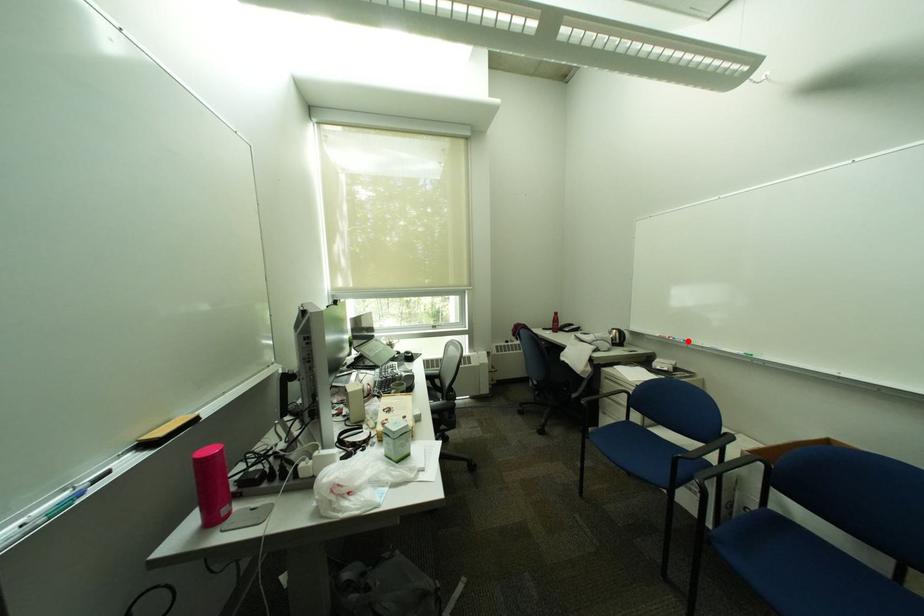
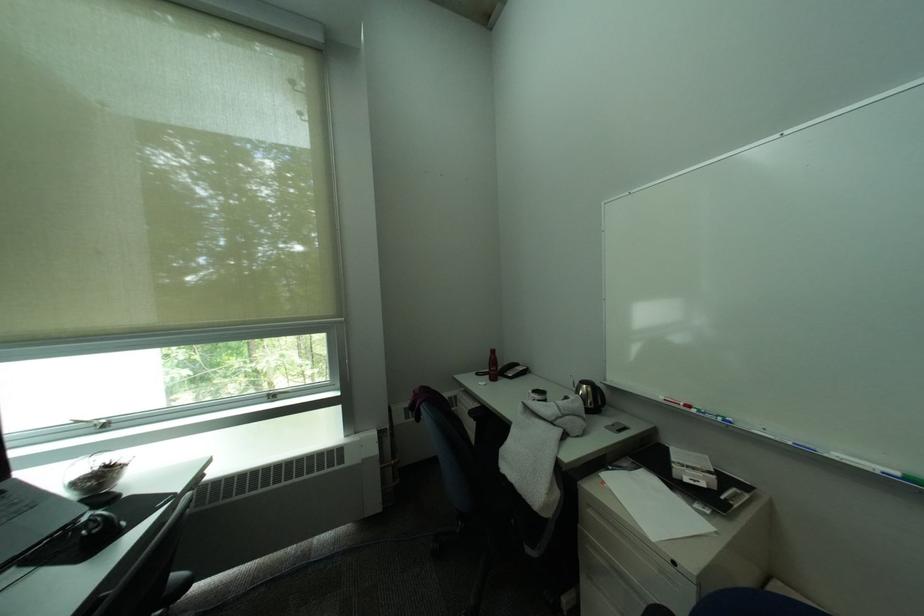
Locate, in the second image, the point that corresponds to the highlighted location in the first image.

(719, 416)